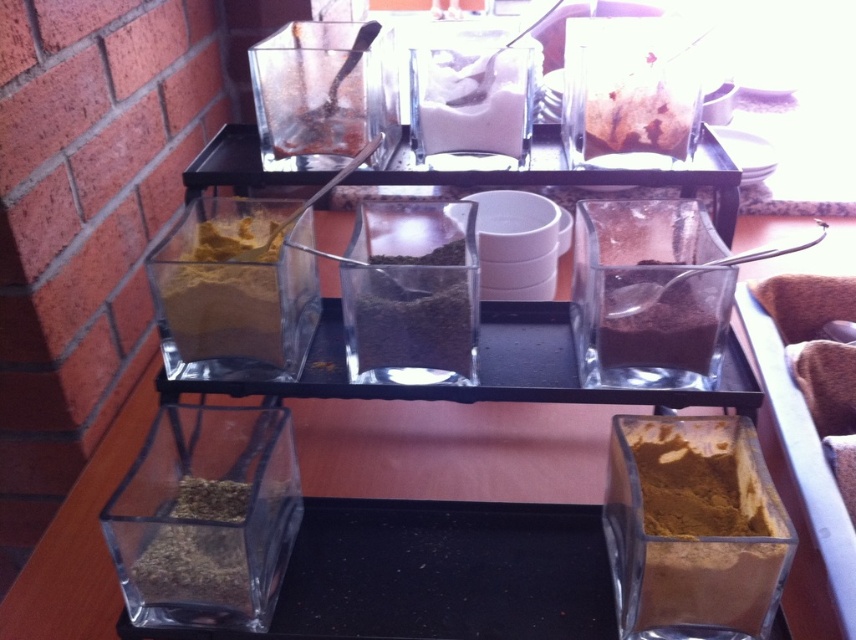
You are a chef preparing a recipe that requires both the dark green granular spice at center and the dark brown powder at center. You need to reach for both spices from your current position in front of the rack. Which spice will you need to move closer to you first?

The dark green granular spice at center is in front of the dark brown powder at center, so you will need to reach for the dark green granular spice at center first before accessing the dark brown powder at center.

You are organizing the spice rack and need to ensure that the taller container is placed on the bottom tier for stability. Which container between the dark green granular spice at center and the dark brown powder at center should be moved to the bottom tier?

The dark green granular spice at center should be moved to the bottom tier because it has a greater height compared to the dark brown powder at center, making it more stable there.

Consider the image. You are a chef preparing a recipe that requires both the white powder at center and the dark brown powder at center. You have a measuring spoon in your hand. Can you easily reach both containers without moving your hand more than 10 inches?

The white powder at center and dark brown powder at center are 8.96 inches apart, so yes, you can easily reach both containers without moving your hand more than 10 inches.